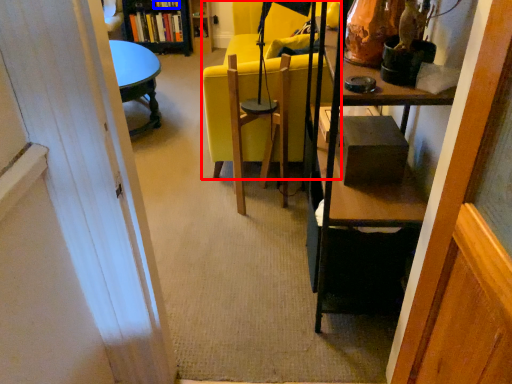
Question: Which of the following is the closest to the observer, chair (highlighted by a red box) or book (highlighted by a blue box)?

Choices:
 (A) chair
 (B) book

Answer: (A)